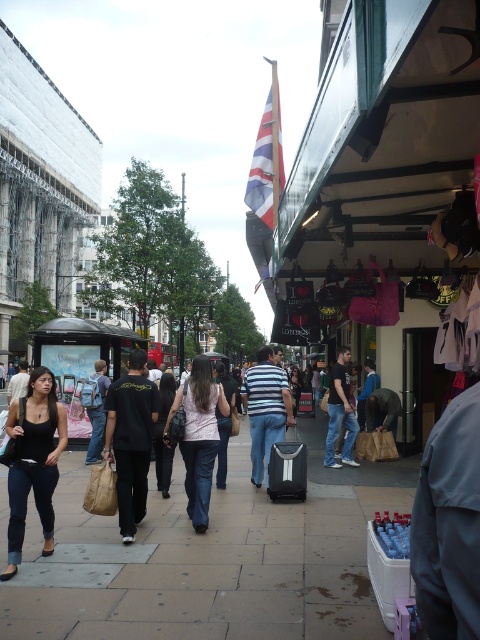
In the scene shown: You are a delivery person who needs to place a striped cotton shirt at center and a black fabric suitcase at center onto a delivery cart that can only hold items within a 36 inch width. Can both items fit side by side on the cart?

The striped cotton shirt at center is 33.99 inches from the black fabric suitcase at center, so the total width required would be the sum of both items. However, the distance between them here is 33.99 inches, which might indicate their separation rather than individual sizes. Without knowing each item size, we can only confirm the space between them, not their individual widths. Thus, it is unclear if they can fit within the 36 inch limit.

You are a delivery person who needs to place both the striped cotton shirt at center and the black fabric suitcase at center into a storage locker. The locker has a height limit of 1 meter. Which item might exceed the height limit?

The striped cotton shirt at center has a greater height compared to the black fabric suitcase at center, so it might exceed the height limit of 1 meter.

From the picture: You are a delivery person who needs to place a fragile package on the black fabric suitcase at center. However, there is a striped cotton shirt at center in the way. Can you move the shirt to make space?

The striped cotton shirt at center is located above the black fabric suitcase at center, so you need to move the shirt down to create space for the package.